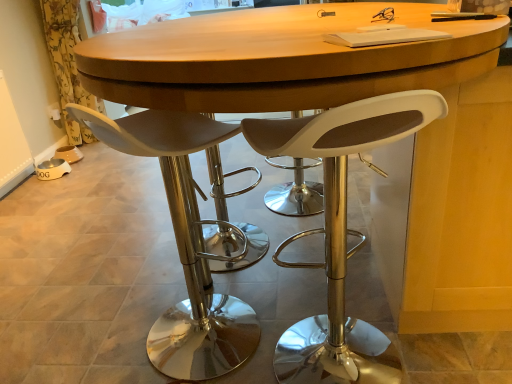
Describe the element at coordinates (185, 245) in the screenshot. I see `white matte stool at center, acting as the second chair starting from the right` at that location.

Identify the location of white matte stool at center, arranged as the first chair when viewed from the left. (185, 245).

Find the location of a particular element. white matte stool at center, which is the second chair from left to right is located at coordinates (x=339, y=232).

Is point (138, 146) behind point (66, 68)?

No.

Does white matte stool at center, arranged as the first chair when viewed from the left, turn towards yellow floral fabric at left?

No, white matte stool at center, arranged as the first chair when viewed from the left, is not oriented towards yellow floral fabric at left.

Is white matte stool at center, arranged as the first chair when viewed from the left, bigger than yellow floral fabric at left?

Incorrect, white matte stool at center, arranged as the first chair when viewed from the left, is not larger than yellow floral fabric at left.

Is white matte stool at center, acting as the second chair starting from the right, outside of yellow floral fabric at left?

Yes.

Between white matte stool at center, which is the first chair from right to left, and yellow floral fabric at left, which one has smaller width?

yellow floral fabric at left.

Which of these two, white matte stool at center, which is the first chair from right to left, or yellow floral fabric at left, is bigger?

Bigger between the two is white matte stool at center, which is the first chair from right to left.

Is white matte stool at center, which is the second chair from left to right, looking in the opposite direction of yellow floral fabric at left?

No, yellow floral fabric at left is not at the back of white matte stool at center, which is the second chair from left to right.

From a real-world perspective, is white matte stool at center, which is the second chair from left to right, on yellow floral fabric at left?

No, from a real-world perspective, white matte stool at center, which is the second chair from left to right, is not above yellow floral fabric at left.

From the picture: Considering the sizes of objects yellow floral fabric at left and white matte stool at center, which is the second chair from left to right, in the image provided, who is thinner, yellow floral fabric at left or white matte stool at center, which is the second chair from left to right,?

With smaller width is yellow floral fabric at left.

Identify the location of curtain behind the white matte stool at center, which is the first chair from right to left. coord(67,63).

In the scene shown: Can you confirm if yellow floral fabric at left is positioned to the right of white matte stool at center, which is the first chair from right to left?

No, yellow floral fabric at left is not to the right of white matte stool at center, which is the first chair from right to left.

Identify the location of chair that appears on the left of white matte stool at center, which is the second chair from left to right. The image size is (512, 384). (185, 245).

Which of these two, white matte stool at center, acting as the second chair starting from the right, or white matte stool at center, which is the first chair from right to left, is bigger?

white matte stool at center, which is the first chair from right to left.

Could you measure the distance between white matte stool at center, arranged as the first chair when viewed from the left, and white matte stool at center, which is the first chair from right to left?

white matte stool at center, arranged as the first chair when viewed from the left, and white matte stool at center, which is the first chair from right to left, are 12.53 inches apart.

Considering the sizes of objects white matte stool at center, which is the second chair from left to right, and white matte stool at center, arranged as the first chair when viewed from the left, in the image provided, who is bigger, white matte stool at center, which is the second chair from left to right, or white matte stool at center, arranged as the first chair when viewed from the left,?

With larger size is white matte stool at center, which is the second chair from left to right.

Is point (411, 97) in front of point (175, 355)?

Yes, it is in front of point (175, 355).

Is white matte stool at center, which is the second chair from left to right, at the right side of white matte stool at center, arranged as the first chair when viewed from the left?

Indeed, white matte stool at center, which is the second chair from left to right, is positioned on the right side of white matte stool at center, arranged as the first chair when viewed from the left.

Is white matte stool at center, which is the first chair from right to left, not close to white matte stool at center, arranged as the first chair when viewed from the left?

No, white matte stool at center, which is the first chair from right to left, is in close proximity to white matte stool at center, arranged as the first chair when viewed from the left.

I want to click on curtain behind the white matte stool at center, arranged as the first chair when viewed from the left, so click(67, 63).

Does yellow floral fabric at left turn towards white matte stool at center, acting as the second chair starting from the right?

No, yellow floral fabric at left is not oriented towards white matte stool at center, acting as the second chair starting from the right.

Who is bigger, yellow floral fabric at left or white matte stool at center, arranged as the first chair when viewed from the left?

With larger size is yellow floral fabric at left.

Is yellow floral fabric at left located outside white matte stool at center, arranged as the first chair when viewed from the left?

That's correct, yellow floral fabric at left is outside of white matte stool at center, arranged as the first chair when viewed from the left.

Where is `chair that is the 1st one when counting rightward from the yellow floral fabric at left`? Image resolution: width=512 pixels, height=384 pixels. chair that is the 1st one when counting rightward from the yellow floral fabric at left is located at coordinates [185, 245].

From the image's perspective, which chair is the 2nd one below the yellow floral fabric at left? Please provide its 2D coordinates.

[(339, 232)]

From the image, which object appears to be nearer to white matte stool at center, acting as the second chair starting from the right, yellow floral fabric at left or white matte stool at center, which is the second chair from left to right?

white matte stool at center, which is the second chair from left to right, is closer to white matte stool at center, acting as the second chair starting from the right.

Which object lies further to the anchor point white matte stool at center, which is the second chair from left to right, white matte stool at center, arranged as the first chair when viewed from the left, or yellow floral fabric at left?

Based on the image, yellow floral fabric at left appears to be further to white matte stool at center, which is the second chair from left to right.

Which object lies nearer to the anchor point yellow floral fabric at left, white matte stool at center, acting as the second chair starting from the right, or white matte stool at center, which is the second chair from left to right?

Based on the image, white matte stool at center, acting as the second chair starting from the right, appears to be nearer to yellow floral fabric at left.

From the image, which object appears to be nearer to yellow floral fabric at left, white matte stool at center, which is the second chair from left to right, or white matte stool at center, acting as the second chair starting from the right?

white matte stool at center, acting as the second chair starting from the right.

Based on their spatial positions, is white matte stool at center, which is the second chair from left to right, or yellow floral fabric at left closer to white matte stool at center, arranged as the first chair when viewed from the left?

The object closer to white matte stool at center, arranged as the first chair when viewed from the left, is white matte stool at center, which is the second chair from left to right.

From the image, which object appears to be nearer to white matte stool at center, which is the first chair from right to left, yellow floral fabric at left or white matte stool at center, acting as the second chair starting from the right?

white matte stool at center, acting as the second chair starting from the right, is closer to white matte stool at center, which is the first chair from right to left.

What are the coordinates of `chair between white matte stool at center, which is the first chair from right to left, and yellow floral fabric at left from front to back` in the screenshot? It's located at (185, 245).